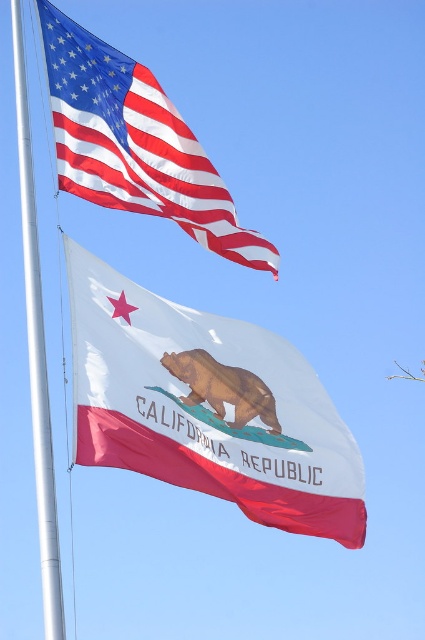
Can you confirm if matte fabric flag at upper left is positioned above silver metallic flag pole at left?

Incorrect, matte fabric flag at upper left is not positioned above silver metallic flag pole at left.

Measure the distance between point (74,170) and camera.

Point (74,170) and camera are 54.21 meters apart from each other.

What do you see at coordinates (135, 144) in the screenshot? This screenshot has height=640, width=425. I see `matte fabric flag at upper left` at bounding box center [135, 144].

The height and width of the screenshot is (640, 425). Find the location of `matte fabric flag at upper left`. matte fabric flag at upper left is located at coordinates click(135, 144).

Which is behind, point (133, 320) or point (221, 364)?

Positioned behind is point (221, 364).

Can you confirm if white glossy fabric flag at center is positioned below brown matte bear at center?

Yes, white glossy fabric flag at center is below brown matte bear at center.

Between point (79, 285) and point (178, 356), which one is positioned in front?

Point (79, 285) is more forward.

You are a GUI agent. You are given a task and a screenshot of the screen. Output one action in this format:
    pyautogui.click(x=<x>, y=<y>)
    Task: Click on the white glossy fabric flag at center
    This screenshot has width=425, height=640.
    Given the screenshot: What is the action you would take?
    pyautogui.click(x=207, y=406)

Does silver metallic flag pole at left have a smaller size compared to brown matte bear at center?

No, silver metallic flag pole at left is not smaller than brown matte bear at center.

Is silver metallic flag pole at left further to camera compared to brown matte bear at center?

No.

What do you see at coordinates (36, 355) in the screenshot?
I see `silver metallic flag pole at left` at bounding box center [36, 355].

Find the location of a particular element. The height and width of the screenshot is (640, 425). silver metallic flag pole at left is located at coordinates (36, 355).